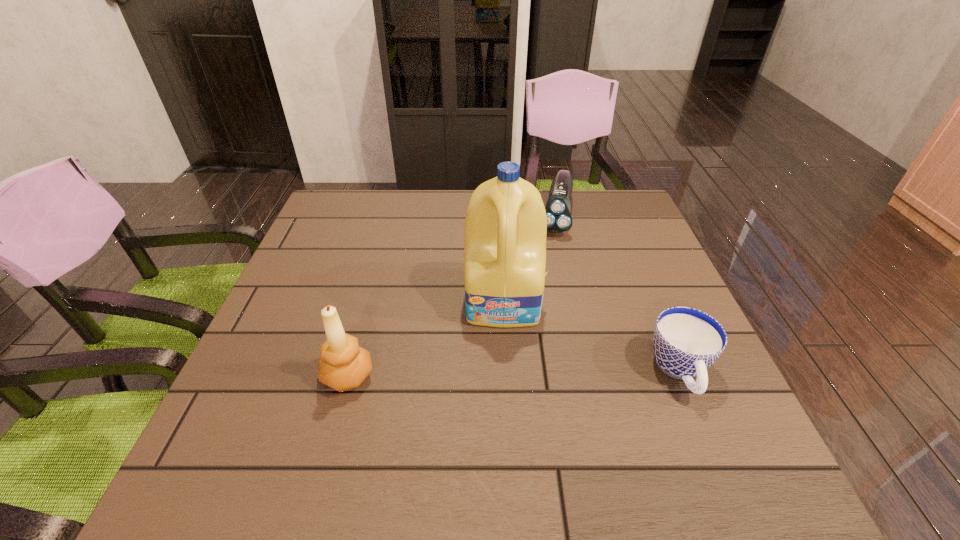
Find the location of a particular element. The image size is (960, 540). free spot between the leftmost object and the cup is located at coordinates (514, 374).

Locate an element on the screen. empty space that is in between the detergent and the leftmost object is located at coordinates (426, 339).

Image resolution: width=960 pixels, height=540 pixels. Identify the location of vacant point located between the tallest object and the cup. (592, 336).

Find the location of a particular element. The image size is (960, 540). free space between the rightmost object and the candle_holder is located at coordinates (514, 374).

Locate an element on the screen. This screenshot has height=540, width=960. free point between the candle_holder and the cup is located at coordinates (514, 374).

Where is `empty space between the leftmost object and the cup`? empty space between the leftmost object and the cup is located at coordinates (514, 374).

Identify the location of free point between the third object from right to left and the third shortest object. (426, 339).

Choose which object is the second nearest neighbor to the tallest object. Please provide its 2D coordinates. Your answer should be formatted as a tuple, i.e. [(x, y)], where the tuple contains the x and y coordinates of a point satisfying the conditions above.

[(343, 366)]

Identify which object is the second closest to the second tallest object. Please provide its 2D coordinates. Your answer should be formatted as a tuple, i.e. [(x, y)], where the tuple contains the x and y coordinates of a point satisfying the conditions above.

[(686, 342)]

The width and height of the screenshot is (960, 540). Find the location of `vacant space that satisfies the following two spatial constraints: 1. on the back side of the second tallest object; 2. on the left side of the second farthest object`. vacant space that satisfies the following two spatial constraints: 1. on the back side of the second tallest object; 2. on the left side of the second farthest object is located at coordinates (369, 301).